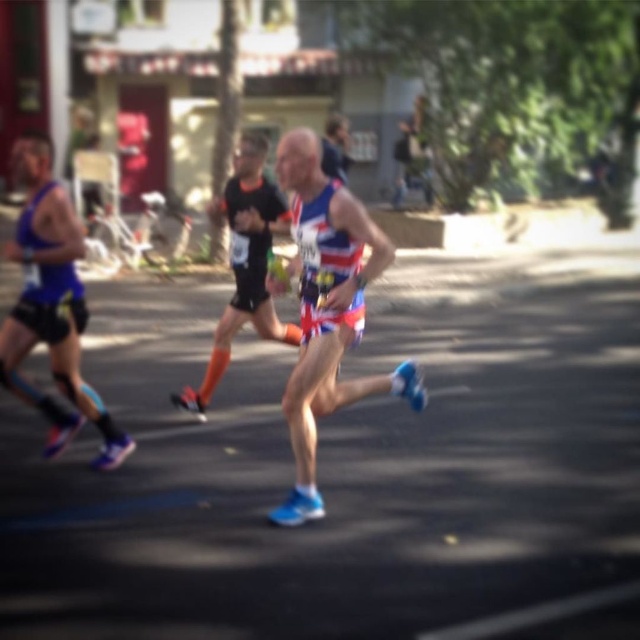
Question: Does matte blue shorts at center have a lesser width compared to matte blue tank top at left?

Choices:
 (A) yes
 (B) no

Answer: (B)

Question: Estimate the real-world distances between objects in this image. Which object is farther from the reflective blue shorts at center?

Choices:
 (A) matte blue tank top at left
 (B) matte blue shorts at center

Answer: (B)

Question: Observing the image, what is the correct spatial positioning of matte blue tank top at left in reference to reflective blue shorts at center?

Choices:
 (A) right
 (B) left

Answer: (B)

Question: Which point is closer to the camera?

Choices:
 (A) (54, 364)
 (B) (260, 236)
 (C) (307, 337)

Answer: (C)

Question: Is matte blue shorts at center above matte blue tank top at left?

Choices:
 (A) yes
 (B) no

Answer: (B)

Question: Estimate the real-world distances between objects in this image. Which object is closer to the matte blue shorts at center?

Choices:
 (A) matte blue tank top at left
 (B) reflective blue shorts at center

Answer: (B)